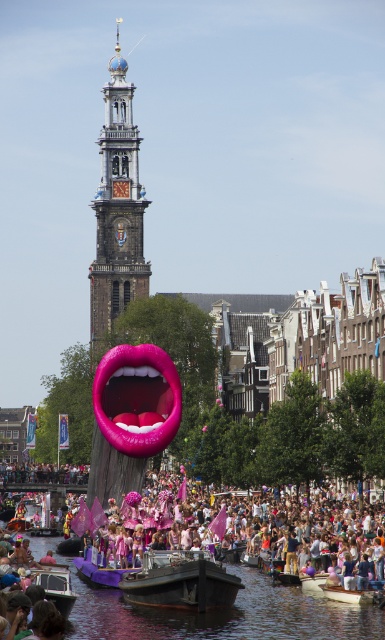
You are standing at the edge of the canal and want to take a photo of the gold ornate clock tower at center. Where should you position yourself to capture the tower in the frame?

The gold ornate clock tower at center is located at point coordinates (x=117, y=209), so positioning yourself at that coordinate will ensure the tower is centered in your photo.